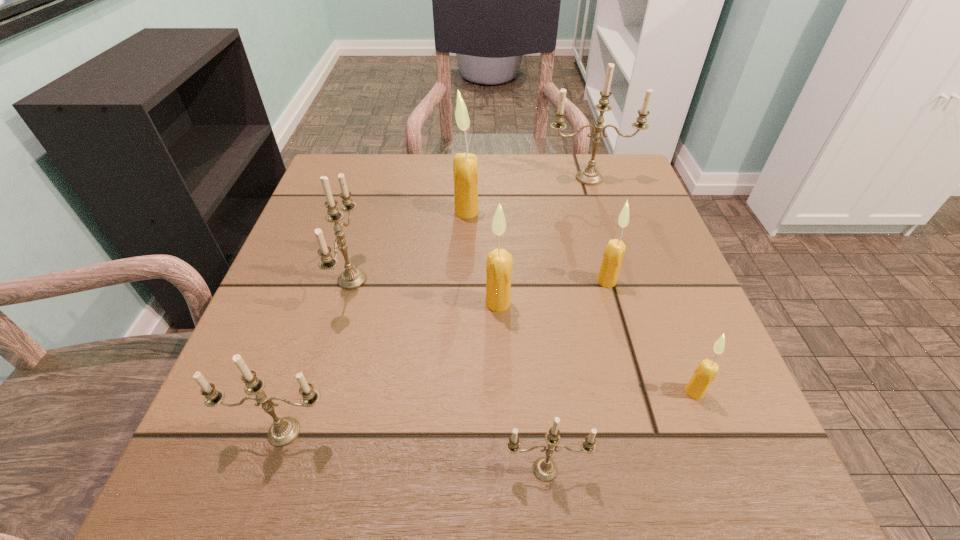
Find the location of a particular element. vacant space at the far right corner of the desktop is located at coordinates (588, 156).

Identify the location of vacant point at the near right corner. (699, 486).

The width and height of the screenshot is (960, 540). Find the location of `vacant area between the rightmost cream candle and the third cream candle from right to left`. vacant area between the rightmost cream candle and the third cream candle from right to left is located at coordinates (596, 347).

You are a GUI agent. You are given a task and a screenshot of the screen. Output one action in this format:
    pyautogui.click(x=<x>, y=<y>)
    Task: Click on the free point between the second farthest metallic candle and the second smallest cream candle
    Image resolution: width=960 pixels, height=540 pixels.
    Given the screenshot: What is the action you would take?
    pyautogui.click(x=479, y=280)

At what (x,y) coordinates should I click in order to perform the action: click on empty space between the farthest candle and the third smallest metallic candle. Please return your answer as a coordinate pair (x, y). The image size is (960, 540). Looking at the image, I should click on (470, 229).

Locate an element on the screen. free space between the second cream candle from left to right and the rightmost cream candle is located at coordinates (596, 347).

The width and height of the screenshot is (960, 540). Identify the location of free space that is in between the farthest candle and the third smallest cream candle. (543, 240).

Find the location of a particular element. The image size is (960, 540). vacant space that's between the second cream candle from left to right and the sixth farthest candle is located at coordinates (596, 347).

At what (x,y) coordinates should I click in order to perform the action: click on free space between the second farthest metallic candle and the nearest metallic candle. Please return your answer as a coordinate pair (x, y). Image resolution: width=960 pixels, height=540 pixels. Looking at the image, I should click on (448, 374).

Identify the location of unoccupied position between the smallest metallic candle and the second nearest candle. This screenshot has height=540, width=960. (415, 450).